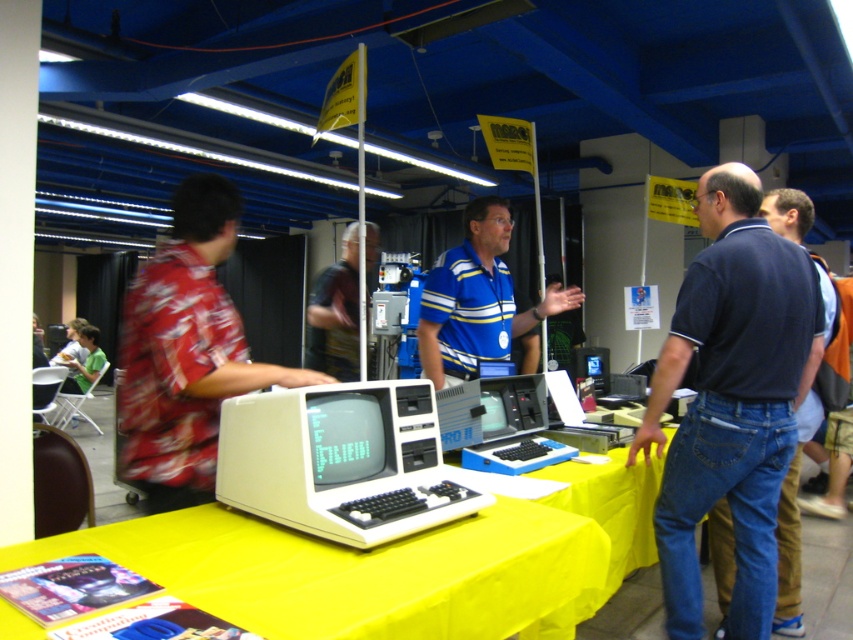
You are organizing a tech event and need to place a 10 cm thick laptop charger on the dark blue cotton shirt at right and the yellow fabric table at center. Which surface can accommodate the charger without bending it?

The yellow fabric table at center can accommodate the 10 cm thick laptop charger since it is thicker than the dark blue cotton shirt at right, providing enough space to place the charger without bending it.

You are a photographer at the event. You want to take a photo of both the blue striped shirt at center and the blue plastic laptop at center without any obstruction. Given that your camera has a minimum focus distance of 12 inches, will you be able to capture both subjects clearly in the same frame?

The blue striped shirt at center is 12.71 inches away from the blue plastic laptop at center. Since the minimum focus distance is 12 inches, the distance between them is sufficient for the camera to capture both subjects clearly in the same frame.